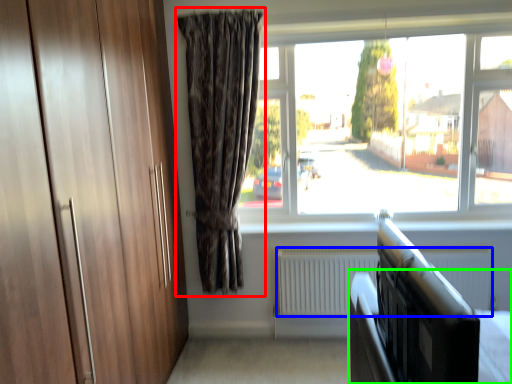
Question: Based on their relative distances, which object is nearer to curtain (highlighted by a red box)? Choose from radiator (highlighted by a blue box) and bed frame (highlighted by a green box).

Choices:
 (A) radiator
 (B) bed frame

Answer: (A)